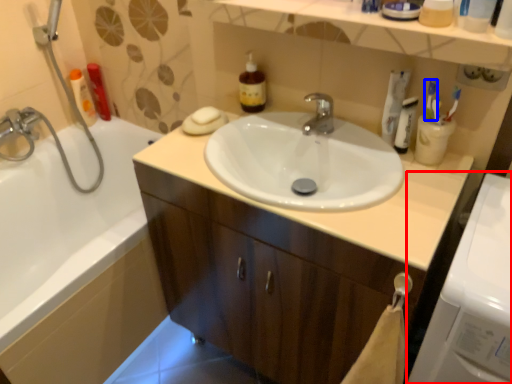
Question: Which object appears farthest to the camera in this image, washing machine (highlighted by a red box) or toothbrush (highlighted by a blue box)?

Choices:
 (A) washing machine
 (B) toothbrush

Answer: (B)